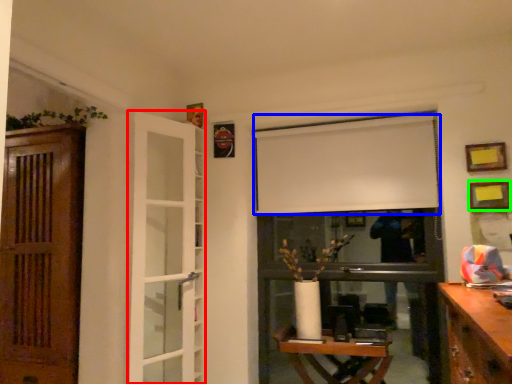
Question: Which object is the closest to the door (highlighted by a red box)? Choose among these: curtain (highlighted by a blue box) or picture frame (highlighted by a green box).

Choices:
 (A) curtain
 (B) picture frame

Answer: (A)